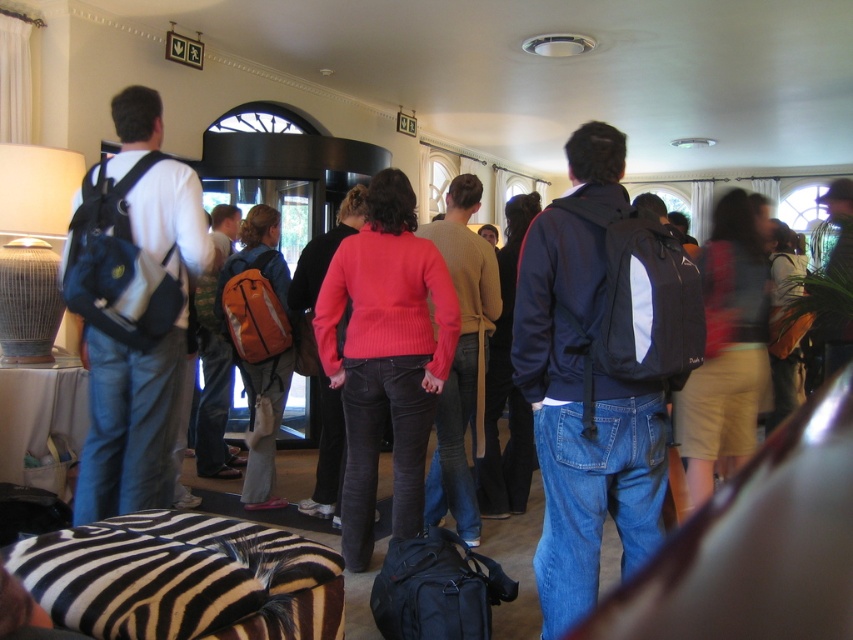
Question: Which point is closer to the camera?

Choices:
 (A) matte black backpack at left
 (B) matte blue jacket at center
 (C) orange fabric backpack at center

Answer: (B)

Question: Can you confirm if pink knit sweater at center is positioned below orange fabric backpack at center?

Choices:
 (A) yes
 (B) no

Answer: (A)

Question: Can you confirm if matte blue jacket at center is positioned to the left of pink knit sweater at center?

Choices:
 (A) yes
 (B) no

Answer: (B)

Question: In this image, where is matte black backpack at left located relative to pink knit sweater at center?

Choices:
 (A) left
 (B) right

Answer: (A)

Question: Which point is closer to the camera taking this photo?

Choices:
 (A) (350, 417)
 (B) (279, 339)

Answer: (A)

Question: Among these objects, which one is farthest from the camera?

Choices:
 (A) pink knit sweater at center
 (B) matte black backpack at left
 (C) orange fabric backpack at center
 (D) matte blue jacket at center

Answer: (C)